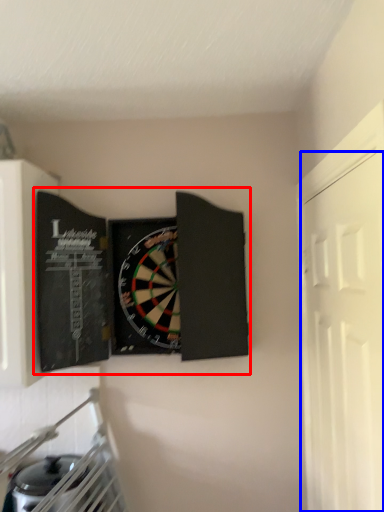
Question: Which of the following is the closest to the observer, book (highlighted by a red box) or door (highlighted by a blue box)?

Choices:
 (A) book
 (B) door

Answer: (B)